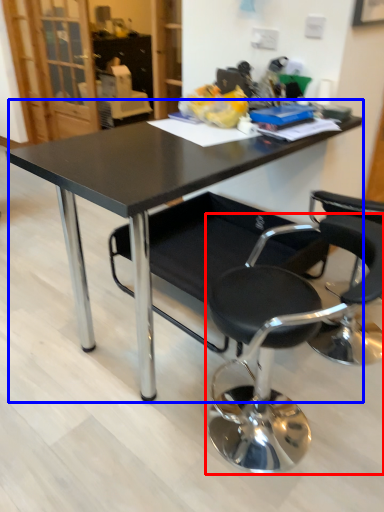
Question: Which object appears farthest to the camera in this image, chair (highlighted by a red box) or table (highlighted by a blue box)?

Choices:
 (A) chair
 (B) table

Answer: (B)